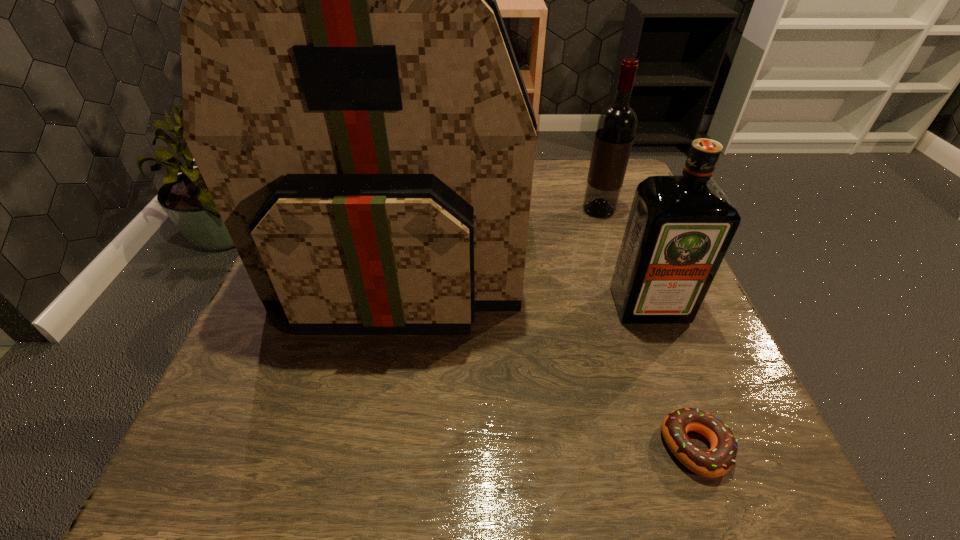
Where is `backpack located in the far edge section of the desktop`? The image size is (960, 540). backpack located in the far edge section of the desktop is located at coordinates (351, 97).

At what (x,y) coordinates should I click in order to perform the action: click on wine bottle located in the far edge section of the desktop. Please return your answer as a coordinate pair (x, y). Image resolution: width=960 pixels, height=540 pixels. Looking at the image, I should click on (616, 127).

Locate an element on the screen. object positioned at the near edge is located at coordinates (717, 461).

The height and width of the screenshot is (540, 960). I want to click on object that is at the left edge, so click(x=351, y=97).

Find the location of a particular element. wine bottle at the right edge is located at coordinates (616, 127).

Find the location of a particular element. The width and height of the screenshot is (960, 540). liquor that is at the right edge is located at coordinates (679, 228).

Locate an element on the screen. The width and height of the screenshot is (960, 540). doughnut at the right edge is located at coordinates (717, 461).

I want to click on object present at the far left corner, so click(x=351, y=97).

I want to click on object positioned at the far right corner, so click(616, 127).

Where is `object that is at the near right corner`? object that is at the near right corner is located at coordinates (717, 461).